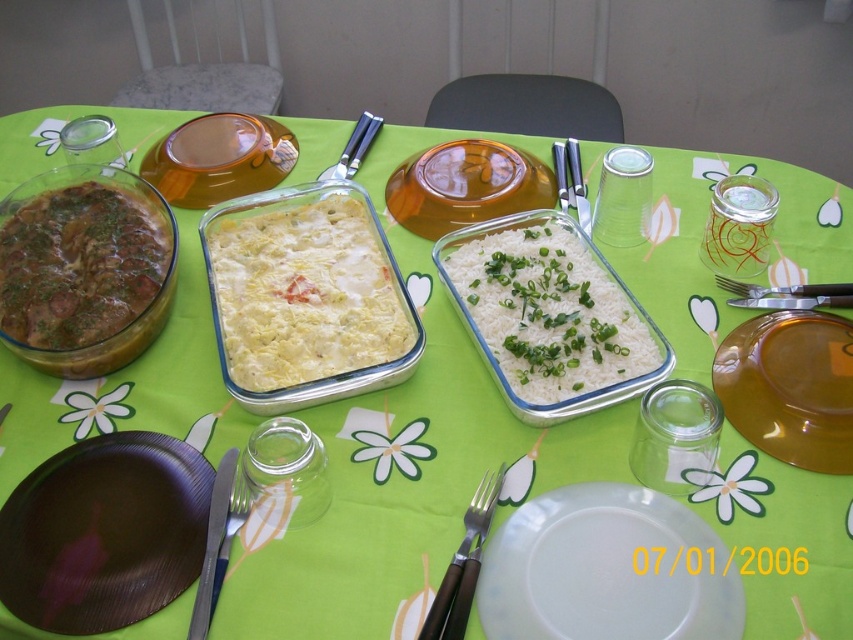
Question: Is brown plastic plate at lower left wider than black metal fork at lower center?

Choices:
 (A) no
 (B) yes

Answer: (B)

Question: Which point is farther from the camera taking this photo?

Choices:
 (A) (189, 532)
 (B) (534, 563)
 (C) (810, 378)
 (D) (584, 291)

Answer: (D)

Question: Which object is the farthest from the brown glossy stew at left?

Choices:
 (A) black metal fork at lower center
 (B) brown plastic plate at lower left
 (C) white glossy plate at center

Answer: (C)

Question: Is white creamy casserole at center further to camera compared to brown glossy stew at left?

Choices:
 (A) yes
 (B) no

Answer: (B)

Question: Is brown plastic plate at lower left to the left of white creamy casserole at center from the viewer's perspective?

Choices:
 (A) no
 (B) yes

Answer: (B)

Question: Considering the real-world distances, which object is closest to the translucent glass platter at center?

Choices:
 (A) white glossy plate at center
 (B) white rice at center
 (C) silver metallic fork at right

Answer: (C)